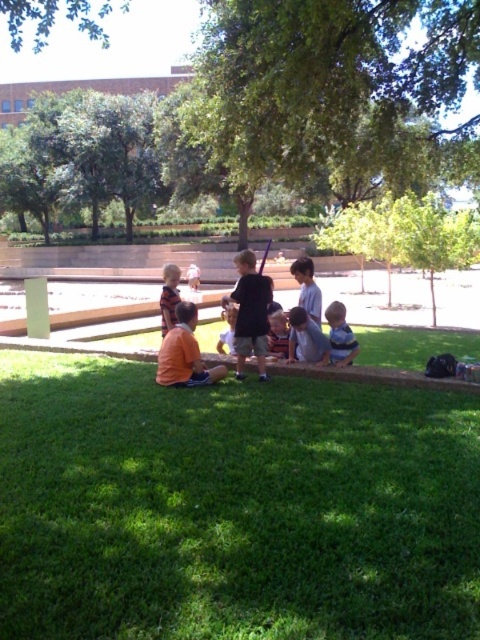
From the picture: Based on the coordinates provided, which object in the scene corresponds to the point at location (232, 506)?

The point at location (232, 506) corresponds to the green grass at lower center.

You are a photographer trying to capture a photo of the striped sweater at center and the green grass at lower center. Based on the scene, which object occupies more horizontal space in the image?

The green grass at lower center occupies more horizontal space in the image because its width is larger than that of the striped sweater at center.